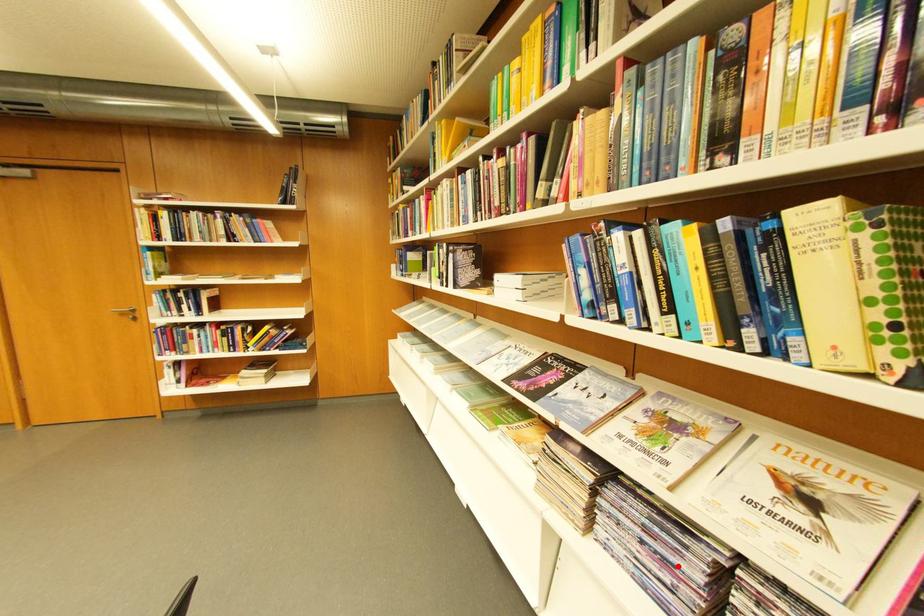
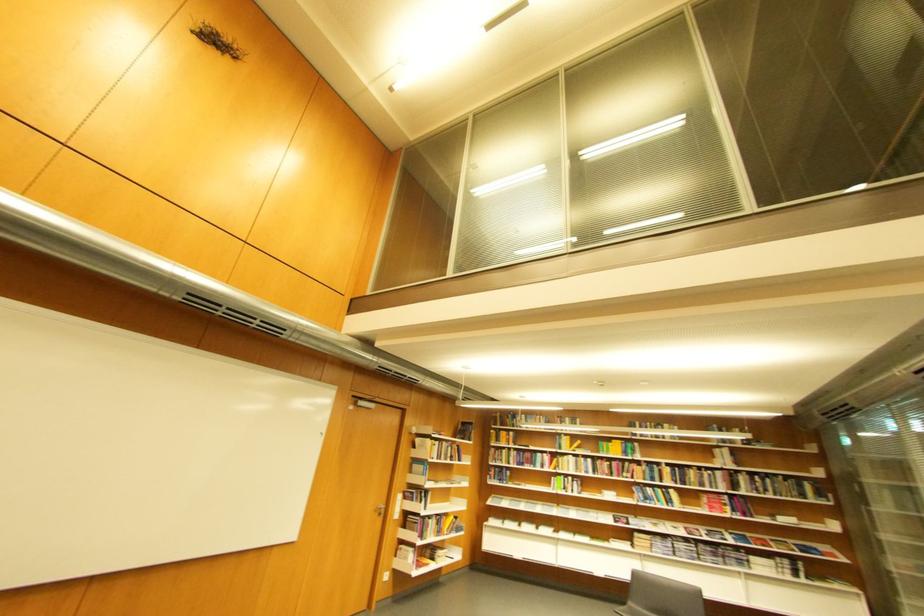
Where in the second image is the point corresponding to the highlighted location from the first image?

(677, 549)